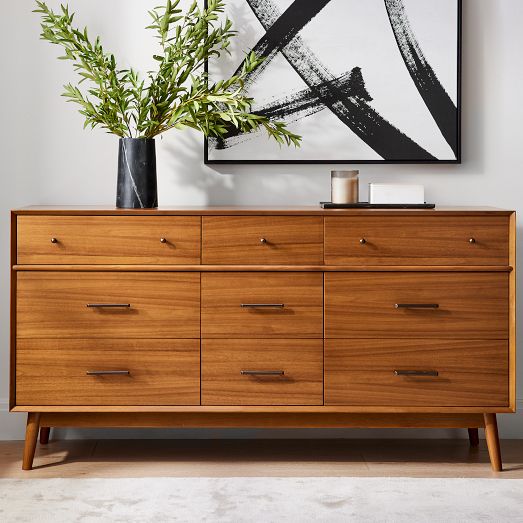
At what (x,y) coordinates should I click in order to perform the action: click on candle container. Please return your answer as a coordinate pair (x, y). Looking at the image, I should click on tap(341, 181).